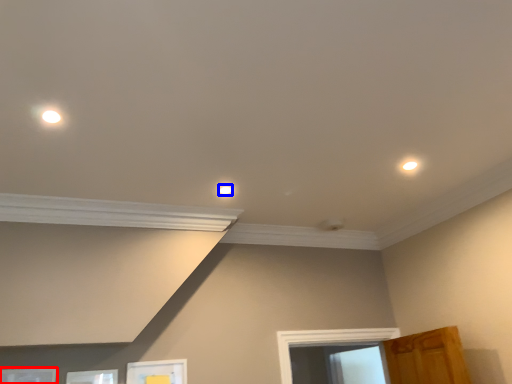
Question: Which point is closer to the camera, picture frame (highlighted by a red box) or dot (highlighted by a blue box)?

Choices:
 (A) picture frame
 (B) dot

Answer: (A)